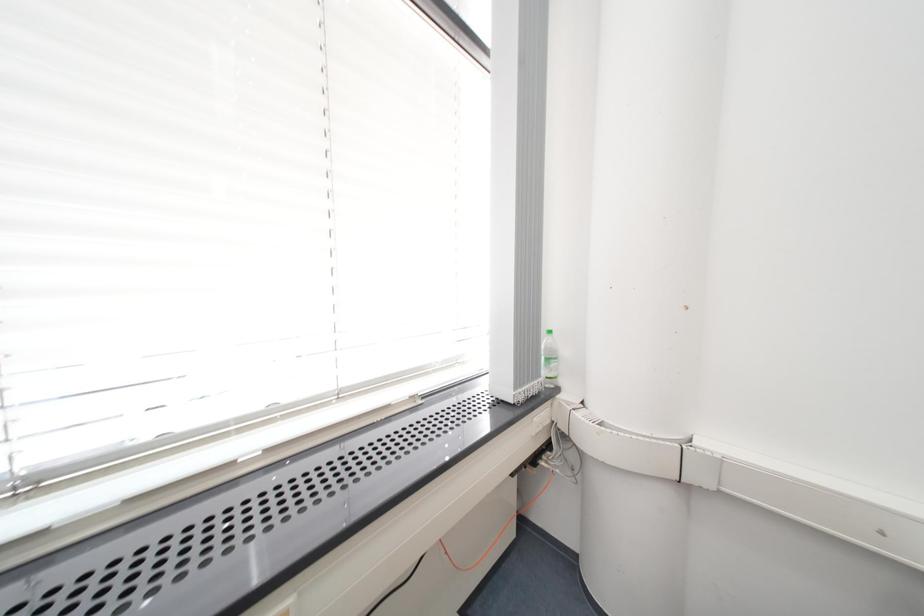
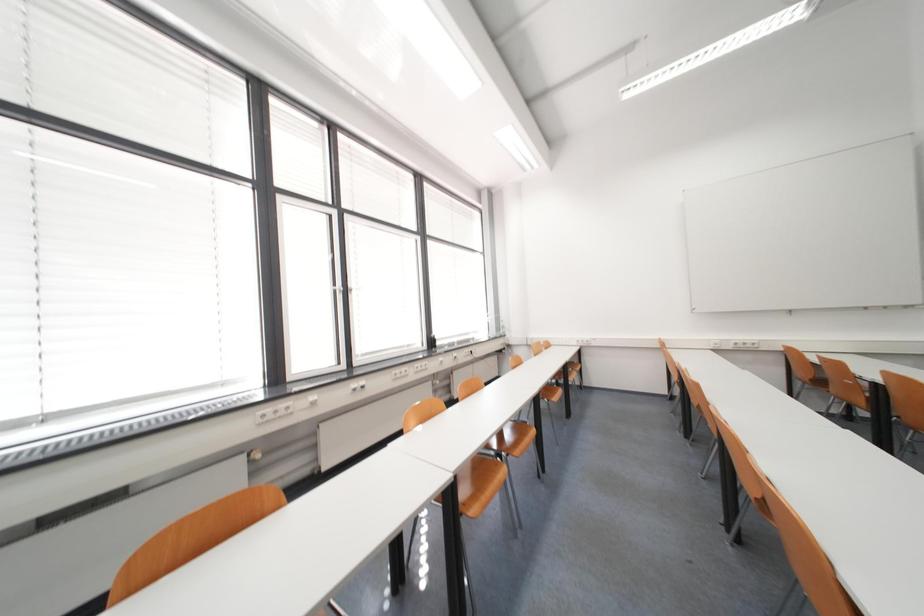
In a continuous first-person perspective shot, in which direction is the camera moving?

The movement direction of the cameraman is left, backward.